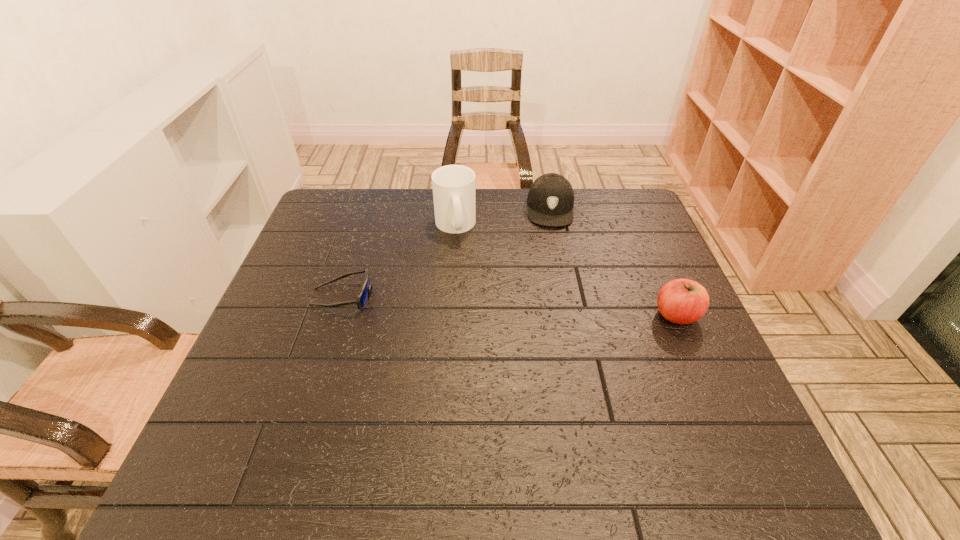
This screenshot has width=960, height=540. I want to click on free spot on the desktop that is between the shortest object and the apple and is positioned on the handle side of the second object from left to right, so click(x=494, y=305).

Locate an element on the screen. free space on the desktop that is between the sunglasses and the apple and is positioned on the front-facing side of the cap is located at coordinates (x=550, y=308).